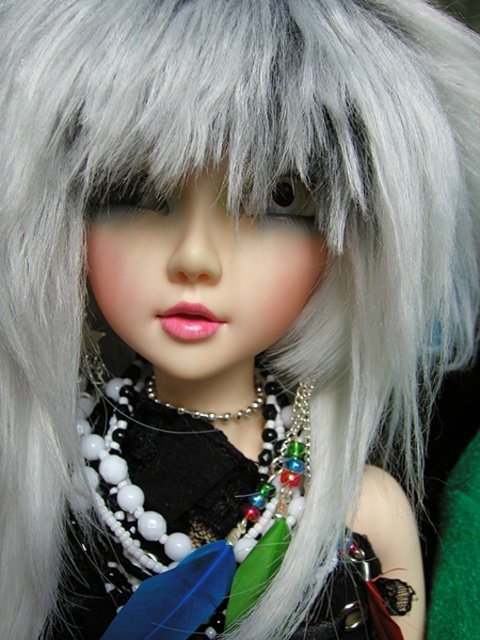
Which is in front, point (119, 410) or point (228, 419)?

Point (228, 419) is more forward.

Where is `multicolored beaded necklace at center`? The height and width of the screenshot is (640, 480). multicolored beaded necklace at center is located at coordinates (180, 516).

Between point (83, 608) and point (148, 388), which one is positioned in front?

Point (83, 608) is in front.

Locate an element on the screen. The width and height of the screenshot is (480, 640). multicolored beaded necklace at center is located at coordinates (180, 516).